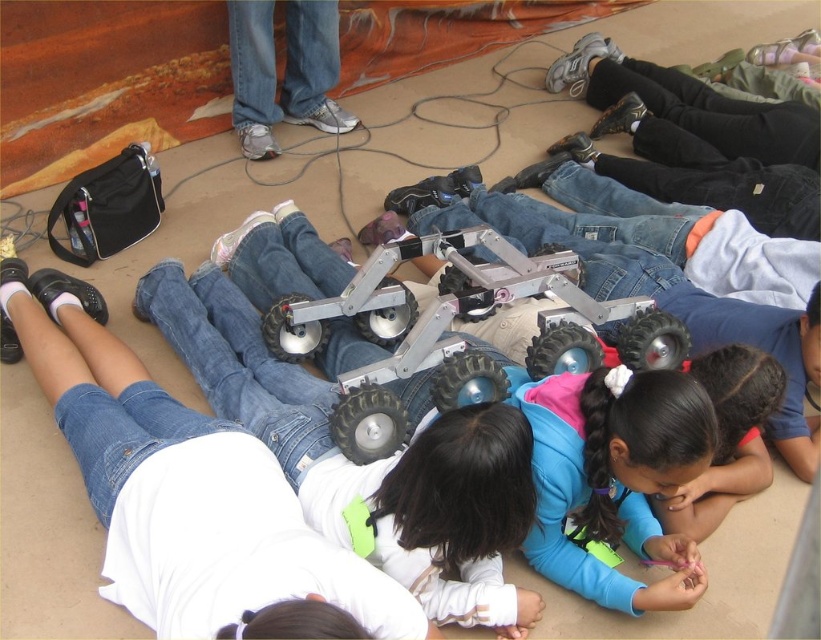
Is blue matte jacket at center to the right of metallic/plastic robot at center from the viewer's perspective?

Correct, you'll find blue matte jacket at center to the right of metallic/plastic robot at center.

Between blue matte jacket at center and metallic/plastic robot at center, which one has more height?

metallic/plastic robot at center is taller.

Where is `blue matte jacket at center`? blue matte jacket at center is located at coordinates pyautogui.click(x=615, y=477).